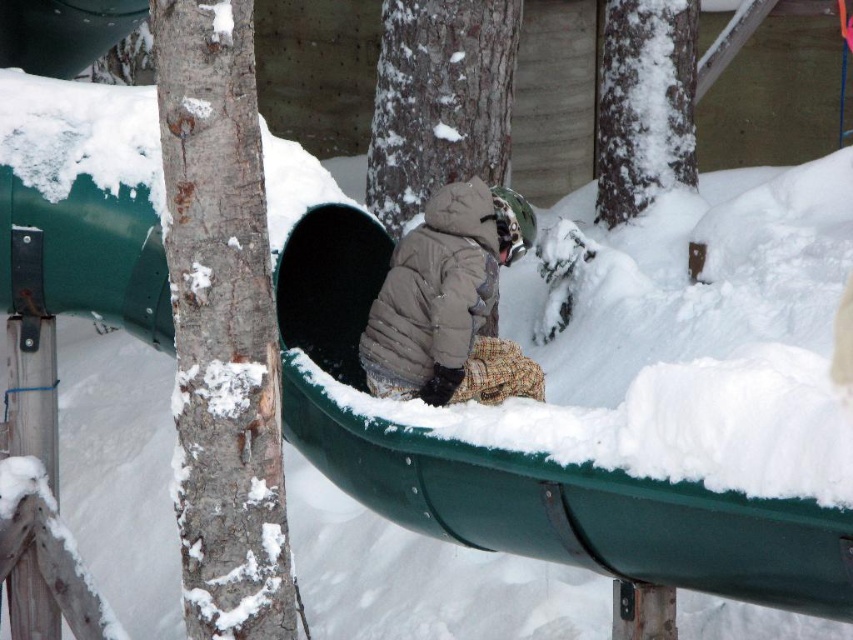
Question: Does smooth bark tree at center appear under snow-covered bark at upper center?

Choices:
 (A) no
 (B) yes

Answer: (B)

Question: Based on their relative distances, which object is nearer to the snow-covered bark at upper center?

Choices:
 (A) gray bark tree at left
 (B) smooth bark tree at center

Answer: (B)

Question: Which object is closer to the camera taking this photo?

Choices:
 (A) snow-covered bark at upper center
 (B) smooth bark tree at center

Answer: (B)

Question: Is gray bark tree at left to the right of smooth bark tree at center from the viewer's perspective?

Choices:
 (A) no
 (B) yes

Answer: (A)

Question: Considering the real-world distances, which object is closest to the matte brown jacket at center?

Choices:
 (A) snow-covered bark at upper center
 (B) smooth bark tree at center

Answer: (B)

Question: Does matte brown jacket at center come in front of smooth bark tree at center?

Choices:
 (A) no
 (B) yes

Answer: (B)